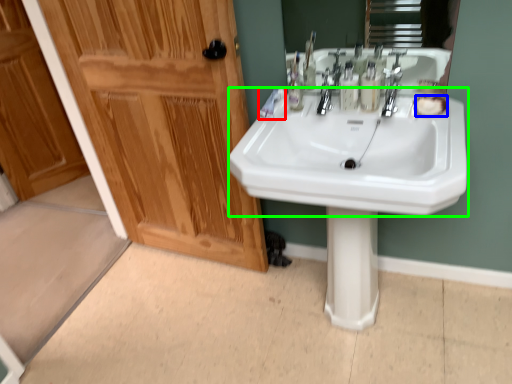
Question: Estimate the real-world distances between objects in this image. Which object is closer to toothpaste (highlighted by a red box), soap (highlighted by a blue box) or sink (highlighted by a green box)?

Choices:
 (A) soap
 (B) sink

Answer: (B)